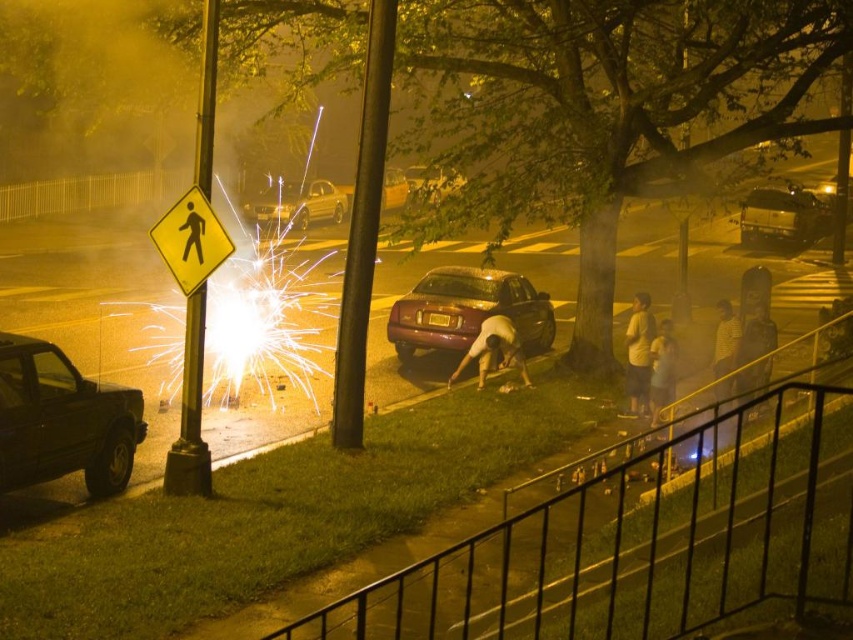
You are a pedestrian trying to cross the street at night. You see a black matte car at left and a light brown leather jacket at lower right. Which object is taller?

The black matte car at left is taller than the light brown leather jacket at lower right.

You are a delivery person who needs to park your van between the maroon metallic sedan at center and the metallic silver sedan at center. Your van is 5 meters long. Is there enough space between them to park your van?

The maroon metallic sedan at center and the metallic silver sedan at center are 9.53 meters apart from each other. Since your van is 5 meters long, there is sufficient space between them to park your van.